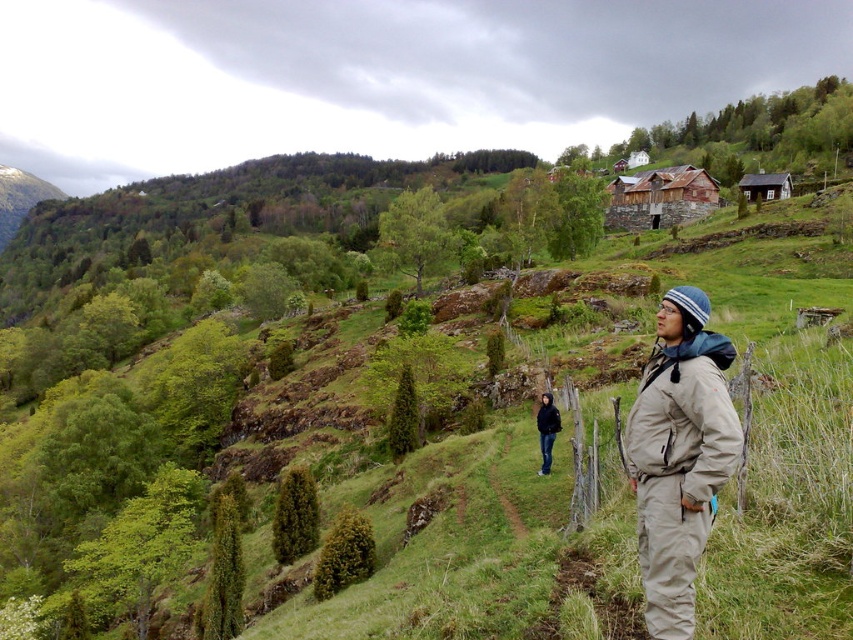
You are standing on the grassy hillside and want to place a small marker at the exact center of the green grassy hillside at center. According to the coordinates provided, where should you place it?

The green grassy hillside at center should be marked at the coordinates point (172, 449).

You are standing on the grassy hillside in the image and want to walk towards the point that is closer to you. Which point should you walk towards, point (476, 556) or point (552, 436)?

Point (476, 556) is in front of point (552, 436), so you should walk towards point (476, 556) since it is closer to you.

You are standing on the green grassy hillside at center and want to move to the khaki fleece jacket at center. Is the distance between them sufficient for you to walk directly towards the jacket without needing to detour around the hillside?

The green grassy hillside at center might be wider than khaki fleece jacket at center, so it is possible that the distance is sufficient to walk directly towards the jacket. However, since the exact width isn not specified, you may need to consider potential obstacles or the actual path available.